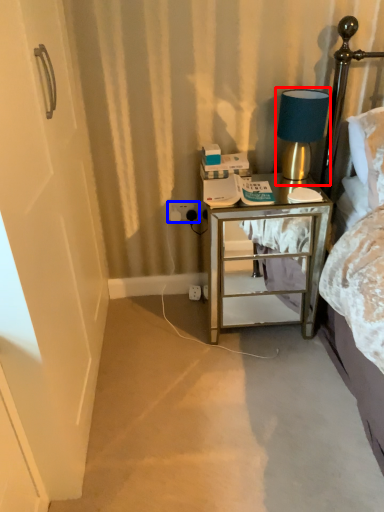
Question: Which of the following is the farthest to the observer, table lamp (highlighted by a red box) or electric outlet (highlighted by a blue box)?

Choices:
 (A) table lamp
 (B) electric outlet

Answer: (B)